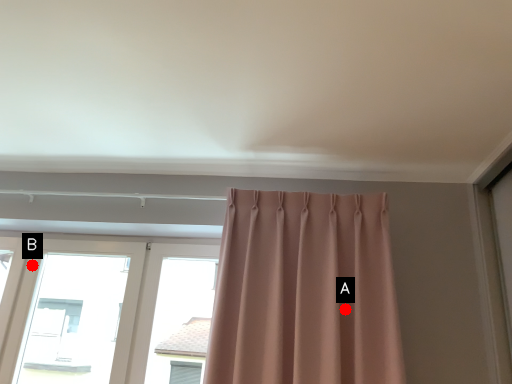
Question: Two points are circled on the image, labeled by A and B beside each circle. Which point is farther from the camera taking this photo?

Choices:
 (A) A is further
 (B) B is further

Answer: (B)